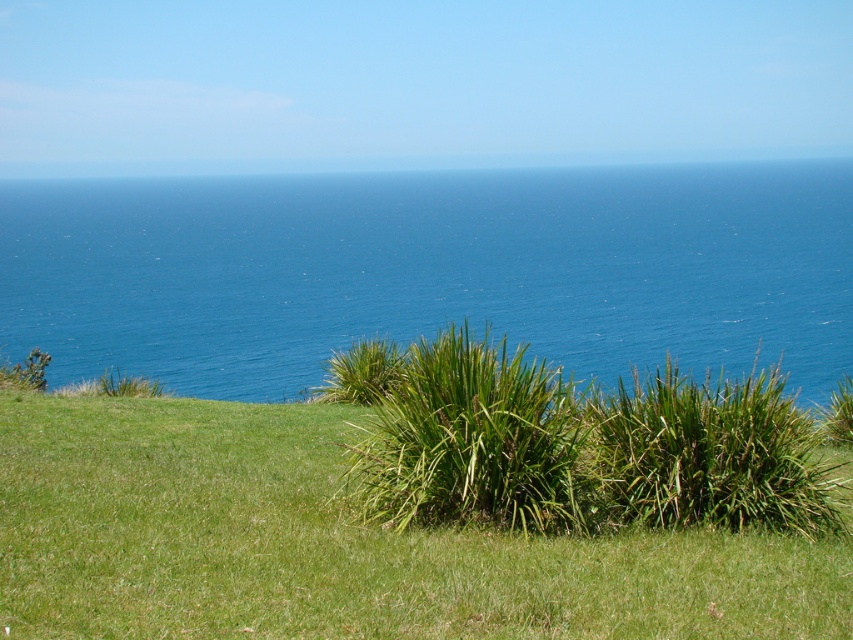
You are standing on the grassy area in the foreground of the coastal landscape. You see the blue water at center and the green leafy shrub at center. Which object is closer to the horizon?

The blue water at center is closer to the horizon because it is taller than the green leafy shrub at center, making it appear farther away in the background.

You are standing on the grassy area in the foreground and want to walk to the blue water at center. There is a green leafy shrub at center in your path. Which direction should you go around it to reach the water?

The blue water at center is positioned on the left side of the green leafy shrub at center, so you should go around the green leafy shrub at center to the left to reach the blue water at center.

You are standing on the green grassy at lower center and want to walk to the blue water at center. Which direction should you go relative to your current position?

Since the blue water at center is closer to you than the green grassy at lower center, you are already on the green grassy at lower center. To reach the blue water at center, you should move forward towards it.